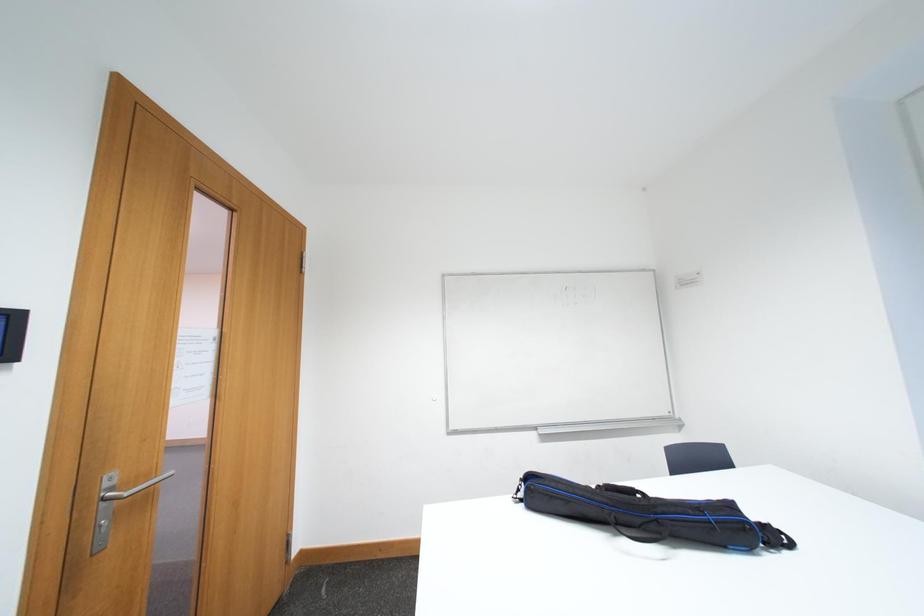
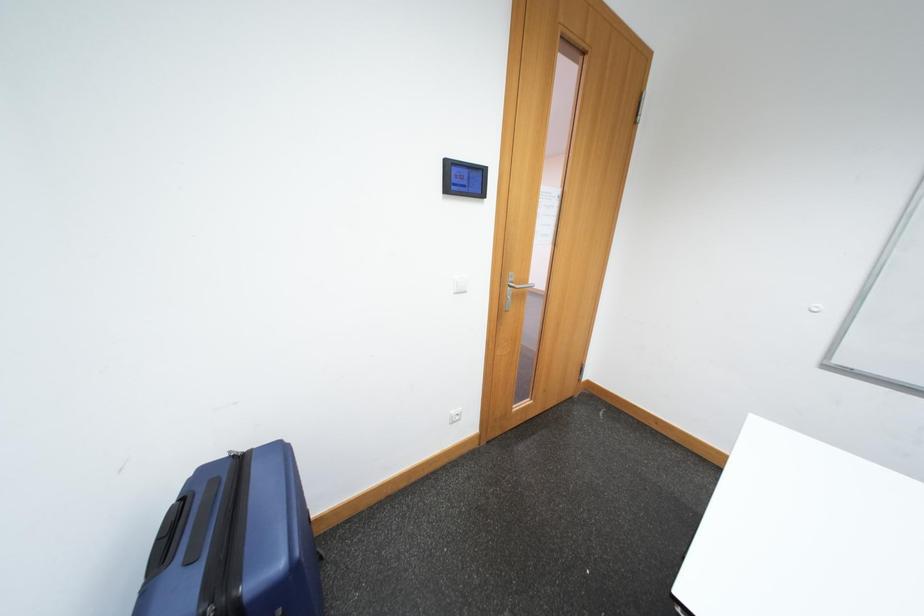
The images are taken continuously from a first-person perspective. In which direction is your viewpoint rotating?

The camera rotated toward left-down.